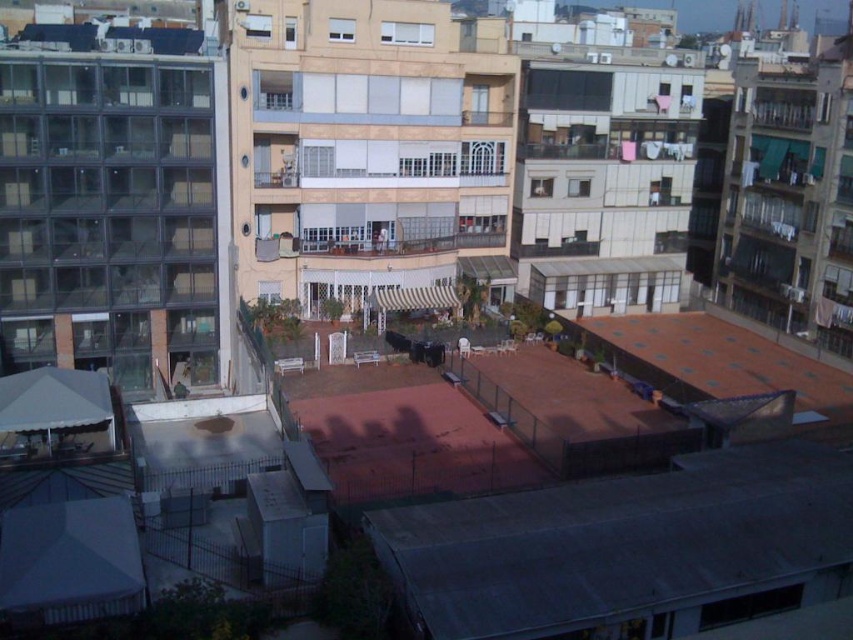
You are planning to install solar panels on the gray metal roof at lower center and brown tiled roof at lower right. Considering their sizes, which roof would allow for more solar panels to be installed?

The brown tiled roof at lower right occupies more space than the gray metal roof at lower center, so it can accommodate more solar panels.